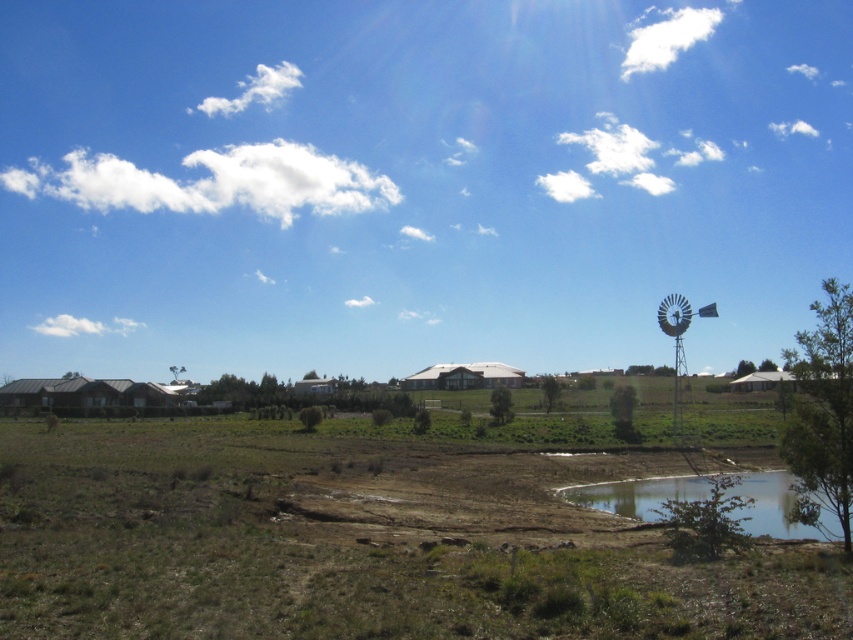
You are planning to set up a picnic area in the green grassy field at center and the clear glass pond at lower right. Which location would allow for a larger picnic setup due to its size?

The green grassy field at center is larger in size than the clear glass pond at lower right, so it can accommodate a larger picnic setup.

You are planning to set up a picnic area in the green grassy field at center and want to place a picnic basket near the clear glass pond at lower right. Can you determine if there is enough space between them to walk comfortably?

The green grassy field at center might be wider than clear glass pond at lower right, so there could be sufficient space between them for comfortable walking.

You are standing at the lower right corner of the image, looking towards the upper right corner. There are two points marked in the scene, point 1 at coordinates point (30,570) and point 2 at coordinates point (746,529). Which point is closer to you?

Point 1 at coordinates point (30,570) is closer to you because it is in front of point 2 at coordinates point (746,529).